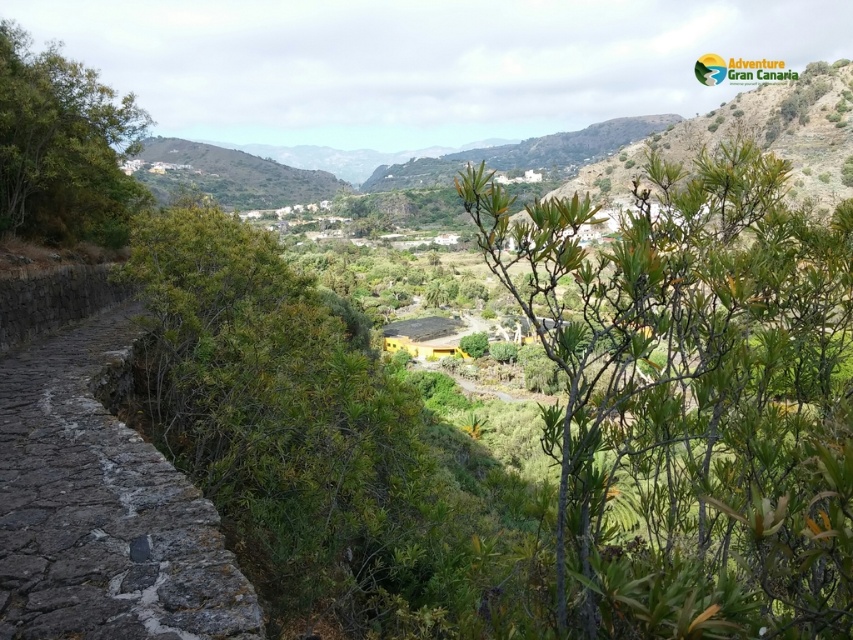
Question: Which of these objects is positioned closest to the green leafy shrub at center?

Choices:
 (A) green leafy shrub at upper left
 (B) dark gray cobblestone path at center

Answer: (A)

Question: Which of the following is the closest to the observer?

Choices:
 (A) green leafy shrub at center
 (B) dark gray cobblestone path at center

Answer: (A)

Question: Can you confirm if green leafy shrub at center is thinner than dark gray cobblestone path at center?

Choices:
 (A) no
 (B) yes

Answer: (A)

Question: Does green leafy shrub at center appear over dark gray cobblestone path at center?

Choices:
 (A) yes
 (B) no

Answer: (A)

Question: Can you confirm if green leafy shrub at center is positioned to the left of dark gray cobblestone path at center?

Choices:
 (A) yes
 (B) no

Answer: (B)

Question: Which object appears closest to the camera in this image?

Choices:
 (A) green leafy shrub at center
 (B) green leafy shrub at upper left

Answer: (A)